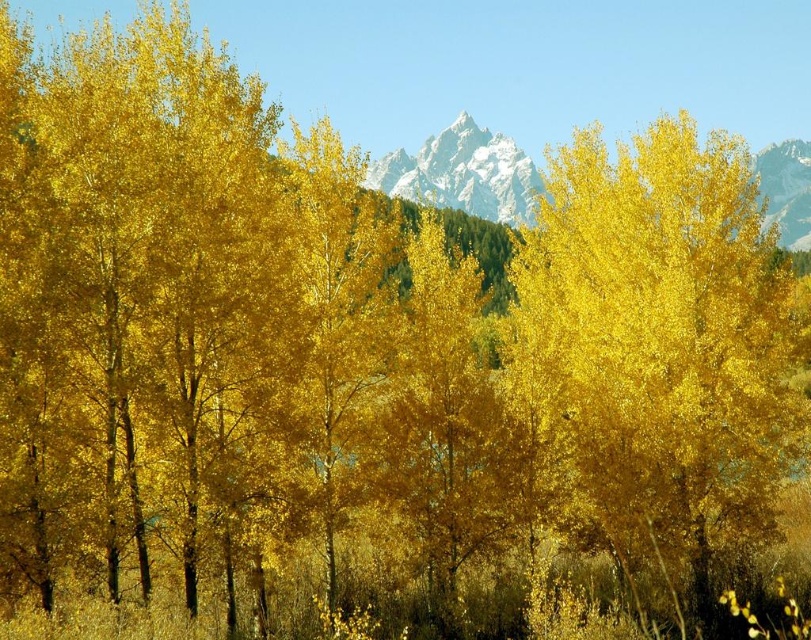
You are an artist planning to paint this autumn scene. You want to ensure the golden glossy tree at center and the white crystalline mountain at center are proportionally accurate. Based on the scene, which object should you make narrower in your painting?

The golden glossy tree at center should be made narrower in the painting since it has a lesser width compared to the white crystalline mountain at center according to the description.

You are standing in the autumnal landscape and want to take a photo of the golden glossy tree at center. If you move 0.1 units to the right along the x and y axes, will you still be able to see the entire tree in your view?

The golden glossy tree at center is located at point [659,346]. Moving 0.1 units to the right along both axes would position you at approximately [740,410]. Since the tree is at the center and the movement is relatively small, you should still be able to see the entire tree in your view.

You are an artist planning to paint the autumn scene. You want to ensure the golden glossy tree at center and the white crystalline mountain at center are proportionally accurate. Which object should you make smaller in your painting?

The golden glossy tree at center should be made smaller in the painting since it has a smaller size compared to the white crystalline mountain at center according to the description.